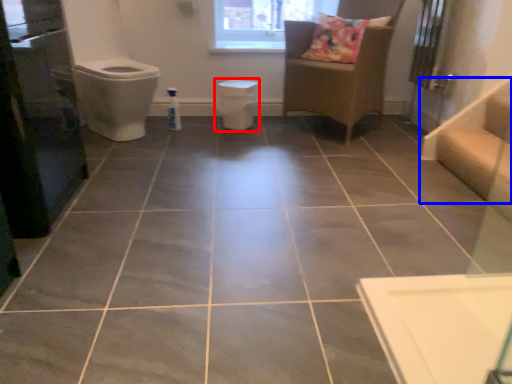
Question: Which object appears closest to the camera in this image, toilet bowl (highlighted by a red box) or stairwell (highlighted by a blue box)?

Choices:
 (A) toilet bowl
 (B) stairwell

Answer: (B)